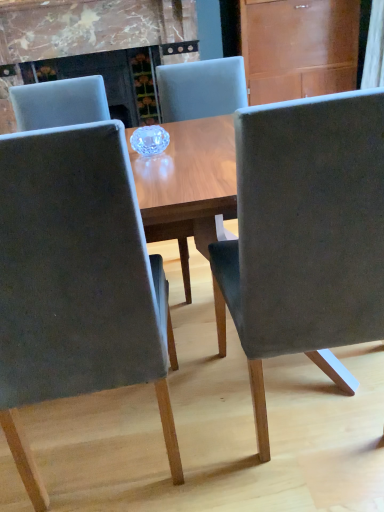
Question: Are suede-like gray chair at center, marked as the third chair in a left-to-right arrangement, and suede-like gray chair at center, the second chair when ordered from left to right, located far from each other?

Choices:
 (A) yes
 (B) no

Answer: (A)

Question: Is suede-like gray chair at center, marked as the third chair in a left-to-right arrangement, not within suede-like gray chair at center, placed as the 2th chair when sorted from right to left?

Choices:
 (A) yes
 (B) no

Answer: (A)

Question: Does suede-like gray chair at center, marked as the third chair in a left-to-right arrangement, have a smaller size compared to suede-like gray chair at center, placed as the 2th chair when sorted from right to left?

Choices:
 (A) no
 (B) yes

Answer: (B)

Question: Is suede-like gray chair at center, arranged as the 1th chair when viewed from the right, bigger than suede-like gray chair at center, the second chair when ordered from left to right?

Choices:
 (A) yes
 (B) no

Answer: (B)

Question: Is suede-like gray chair at center, marked as the third chair in a left-to-right arrangement, facing away from suede-like gray chair at center, the second chair when ordered from left to right?

Choices:
 (A) yes
 (B) no

Answer: (B)

Question: From the image's perspective, is suede-like gray chair at center, arranged as the 1th chair when viewed from the right, above suede-like gray chair at center, the second chair when ordered from left to right?

Choices:
 (A) no
 (B) yes

Answer: (A)

Question: Is velvet gray chair at center, placed as the third chair when sorted from right to left, bigger than suede-like gray chair at center, marked as the third chair in a left-to-right arrangement?

Choices:
 (A) no
 (B) yes

Answer: (A)

Question: Is velvet gray chair at center, placed as the third chair when sorted from right to left, positioned in front of suede-like gray chair at center, marked as the third chair in a left-to-right arrangement?

Choices:
 (A) no
 (B) yes

Answer: (B)

Question: Could you tell me if velvet gray chair at center, placed as the third chair when sorted from right to left, is facing suede-like gray chair at center, arranged as the 1th chair when viewed from the right?

Choices:
 (A) no
 (B) yes

Answer: (A)

Question: Considering the relative sizes of velvet gray chair at center, the first chair from the left, and suede-like gray chair at center, marked as the third chair in a left-to-right arrangement, in the image provided, is velvet gray chair at center, the first chair from the left, taller than suede-like gray chair at center, marked as the third chair in a left-to-right arrangement,?

Choices:
 (A) yes
 (B) no

Answer: (A)

Question: Is velvet gray chair at center, placed as the third chair when sorted from right to left, outside suede-like gray chair at center, arranged as the 1th chair when viewed from the right?

Choices:
 (A) yes
 (B) no

Answer: (A)

Question: Considering the relative sizes of velvet gray chair at center, the first chair from the left, and suede-like gray chair at center, marked as the third chair in a left-to-right arrangement, in the image provided, is velvet gray chair at center, the first chair from the left, shorter than suede-like gray chair at center, marked as the third chair in a left-to-right arrangement,?

Choices:
 (A) yes
 (B) no

Answer: (B)

Question: Can you confirm if wooden at upper right is positioned to the right of suede-like gray chair at center, marked as the third chair in a left-to-right arrangement?

Choices:
 (A) no
 (B) yes

Answer: (B)